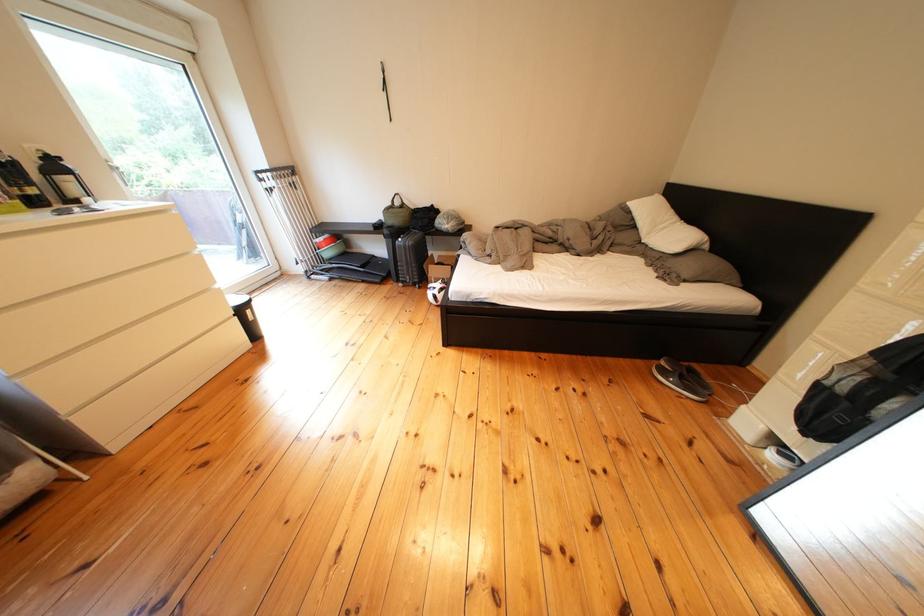
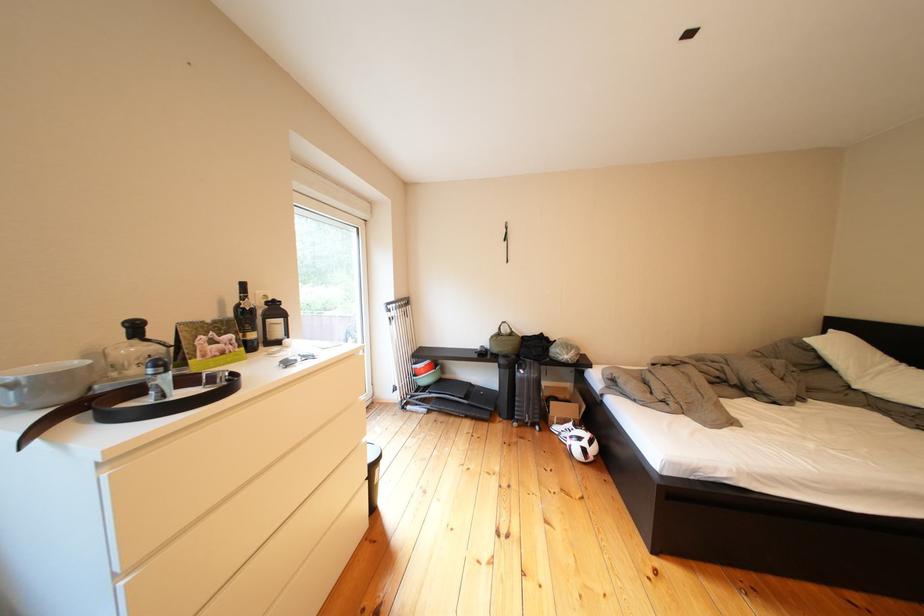
Find the pixel in the second image that matches point 370,254 in the first image.

(462, 381)